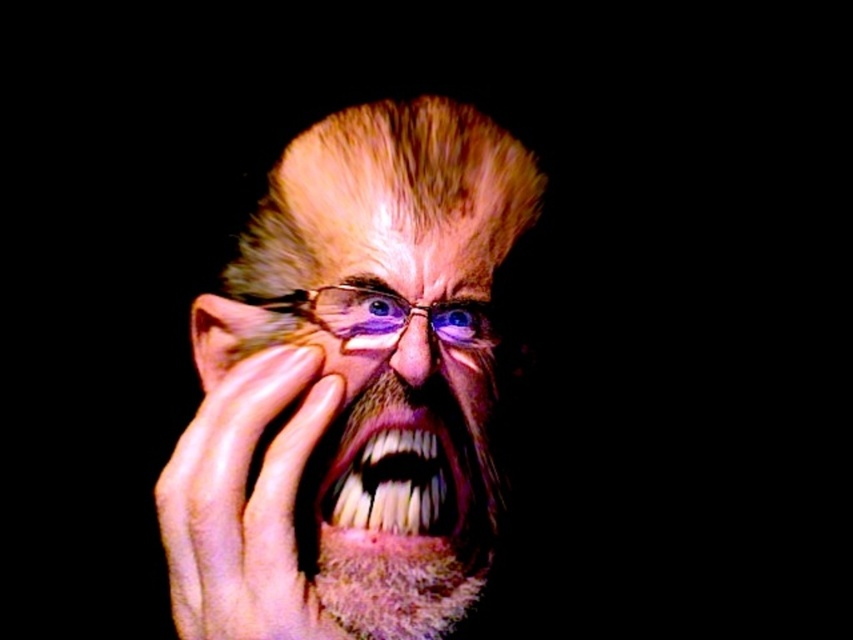
Based on the scene description, which object is positioned lower between the yellowish skin teeth at center and the blue glassy eye at center?

The yellowish skin teeth at center are located below the blue glassy eye at center, so the yellowish skin teeth at center is positioned lower.

You are a photographer adjusting the lighting for a portrait. You notice the smooth skin hand at center and the fuzzy brown beard at center in the frame. Which object should you focus on first to ensure proper exposure, considering their position?

The smooth skin hand at center is in front of the fuzzy brown beard at center, so you should focus on the smooth skin hand at center first to ensure proper exposure.